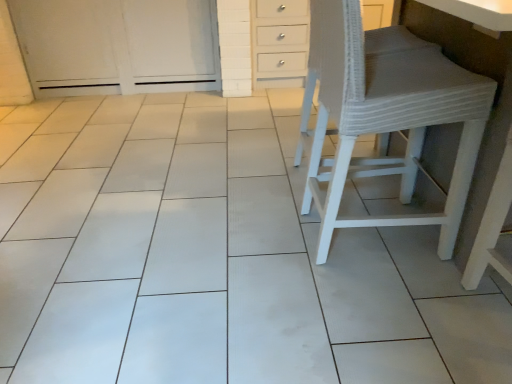
The width and height of the screenshot is (512, 384). Describe the element at coordinates (385, 115) in the screenshot. I see `woven wicker chair at right` at that location.

At what (x,y) coordinates should I click in order to perform the action: click on woven wicker chair at right. Please return your answer as a coordinate pair (x, y). The image size is (512, 384). Looking at the image, I should click on (385, 115).

In order to face woven wicker chair at right, should I rotate leftwards or rightwards?

Rotate right and turn 16.462 degrees.

You are a GUI agent. You are given a task and a screenshot of the screen. Output one action in this format:
    pyautogui.click(x=<x>, y=<y>)
    Task: Click on the woven wicker chair at right
    
    Given the screenshot: What is the action you would take?
    pyautogui.click(x=385, y=115)